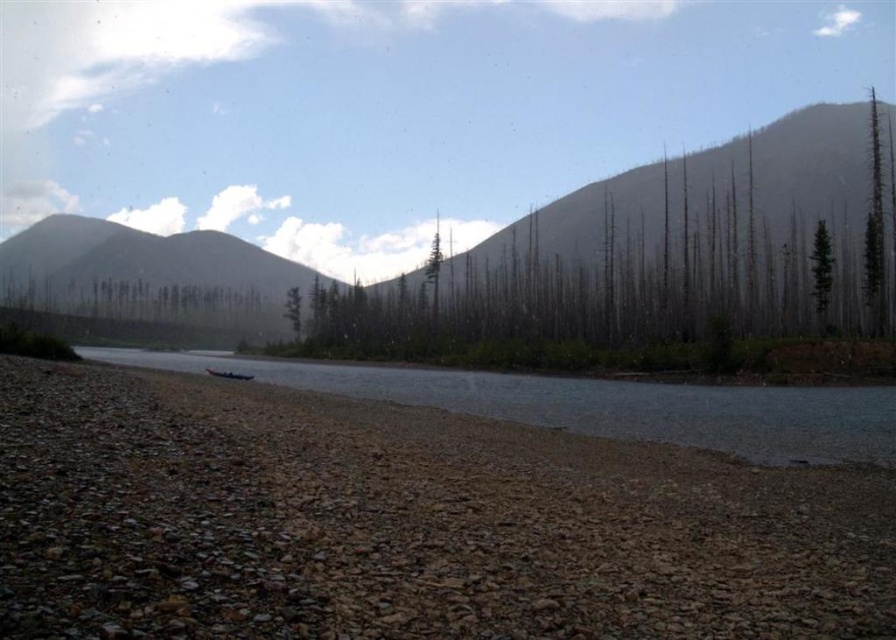
Question: Among these objects, which one is farthest from the camera?

Choices:
 (A) gray rocky mountain at left
 (B) clear water at center

Answer: (A)

Question: Among these objects, which one is farthest from the camera?

Choices:
 (A) brown gravel at lower left
 (B) dead wood at center
 (C) green textured tree at right

Answer: (C)

Question: Does brown gravel at lower left have a smaller size compared to clear water at center?

Choices:
 (A) yes
 (B) no

Answer: (A)

Question: Is brown gravel at lower left closer to the viewer compared to blue plastic boat at lower center?

Choices:
 (A) yes
 (B) no

Answer: (A)

Question: Is gray rocky mountain at left to the right of green matte tree at right from the viewer's perspective?

Choices:
 (A) no
 (B) yes

Answer: (A)

Question: Which of the following is the closest to the observer?

Choices:
 (A) green matte tree at right
 (B) dead wood at center
 (C) blue plastic boat at lower center
 (D) brown gravel at lower left

Answer: (D)